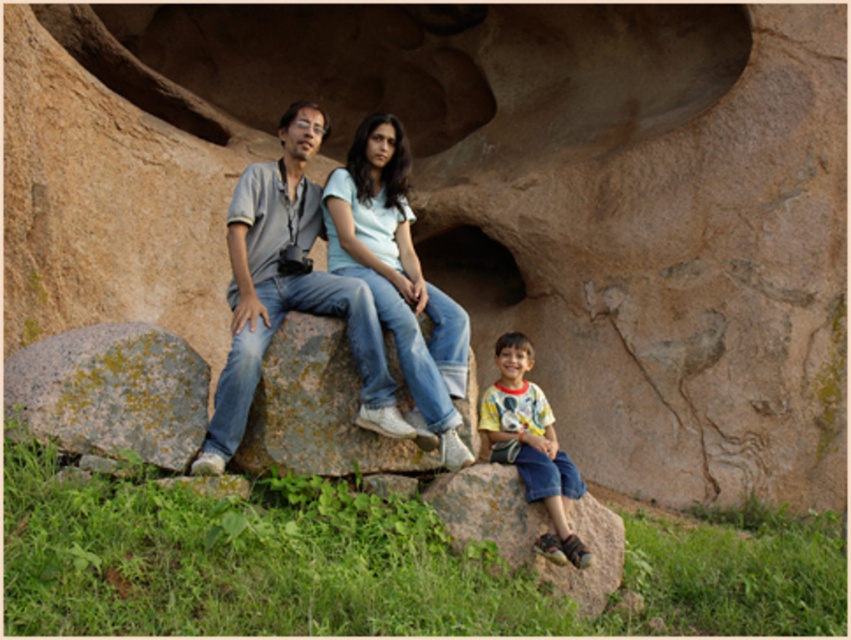
Question: Is rusty metallic rock at center bigger than yellow cotton shirt at lower right?

Choices:
 (A) yes
 (B) no

Answer: (B)

Question: Among these points, which one is nearest to the camera?

Choices:
 (A) (458, 333)
 (B) (600, 513)
 (C) (577, 566)
 (D) (264, 451)

Answer: (C)

Question: Which of the following is the closest to the observer?

Choices:
 (A) denim jeans at center
 (B) light blue denim jeans at center
 (C) brown rough rock at lower right
 (D) rusty metallic rock at center

Answer: (C)

Question: Where is brown rough rock at lower right located in relation to yellow cotton shirt at lower right in the image?

Choices:
 (A) left
 (B) right

Answer: (A)

Question: Which point appears closest to the camera in this image?

Choices:
 (A) (518, 460)
 (B) (324, 436)
 (C) (500, 476)

Answer: (B)

Question: Is rusty metallic rock at center bigger than yellow cotton shirt at lower right?

Choices:
 (A) no
 (B) yes

Answer: (A)